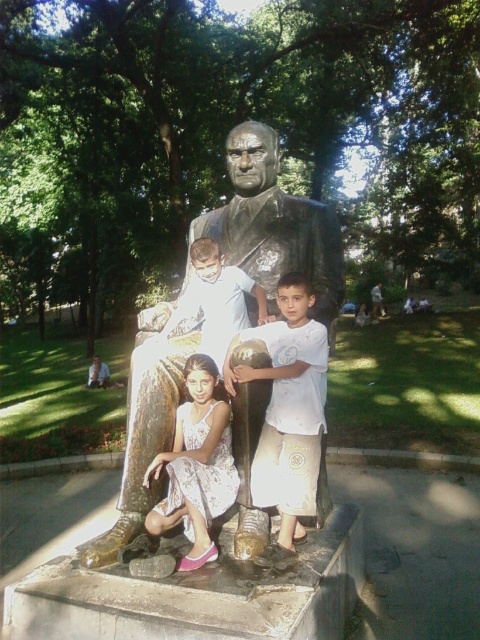
Between white cotton shirt at center and white floral dress at lower center, which one is positioned higher?

Positioned higher is white cotton shirt at center.

Where is `white cotton shirt at center`? white cotton shirt at center is located at coordinates (288, 408).

Is the position of white floral dress at lower center less distant than that of light brown skin at statue center?

Yes, it is.

Is point (153, 472) positioned behind point (157, 333)?

No, it is in front of (157, 333).

The image size is (480, 640). Find the location of `white floral dress at lower center`. white floral dress at lower center is located at coordinates (195, 465).

Is point (277, 273) behind point (245, 314)?

Yes, it is.

At what (x,y) coordinates should I click in order to perform the action: click on bronze statue at center. Please return your answer as a coordinate pair (x, y). Looking at the image, I should click on (274, 225).